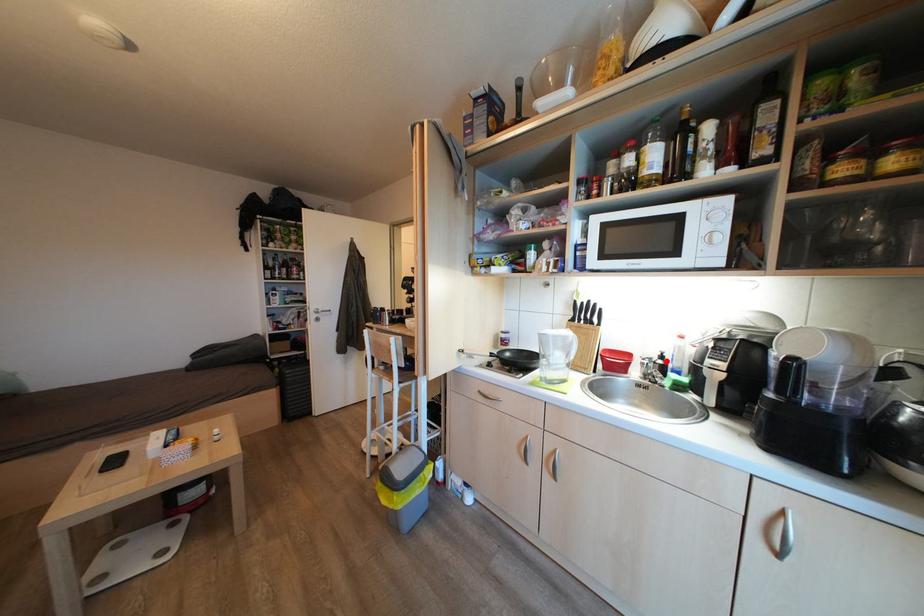
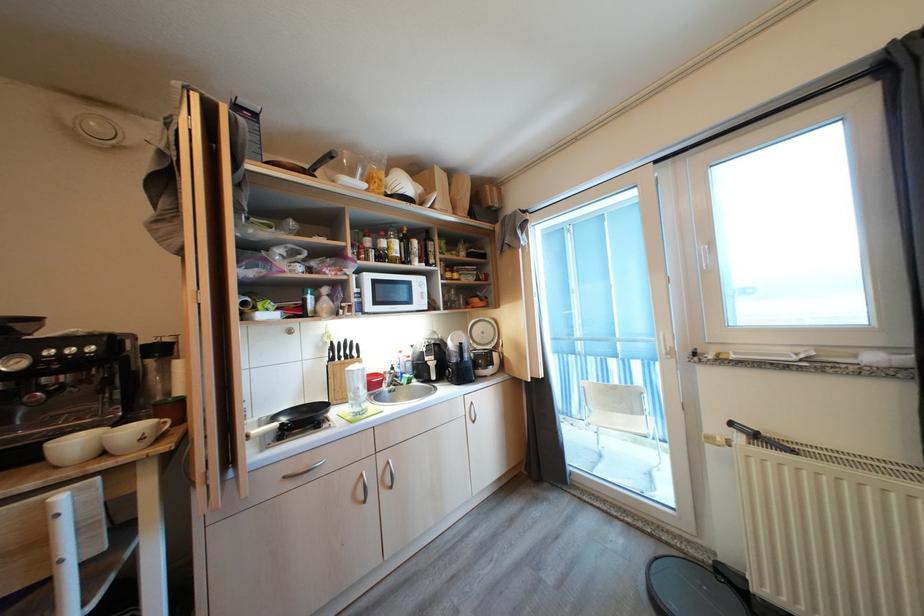
Locate, in the second image, the point that corresponds to the highlighted location in the first image.

(397, 371)